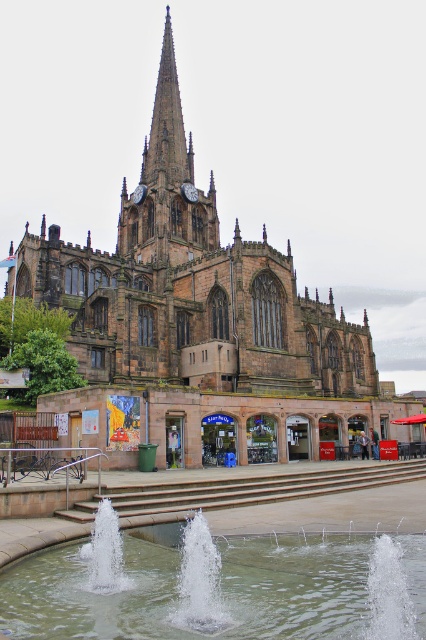
Is point (293, 612) positioned after point (154, 156)?

No, it is in front of (154, 156).

Is clear water fountain at lower center above brown stone spire at upper center?

Actually, clear water fountain at lower center is below brown stone spire at upper center.

Who is more distant from viewer, (229, 584) or (175, 227)?

Point (175, 227)

Find the location of a particular element. This screenshot has height=640, width=426. clear water fountain at lower center is located at coordinates (218, 588).

Is brown stone church at center wider than brown stone spire at upper center?

Yes.

From the picture: Is brown stone church at center to the right of brown stone spire at upper center from the viewer's perspective?

Indeed, brown stone church at center is positioned on the right side of brown stone spire at upper center.

Is point (149, 308) closer to viewer compared to point (203, 234)?

Yes, it is in front of point (203, 234).

In order to click on brown stone church at center in this screenshot , I will do `click(201, 316)`.

Does brown stone church at center lie in front of clear water fountain at lower center?

No, brown stone church at center is further to the viewer.

Does brown stone church at center have a larger size compared to clear water fountain at lower center?

Indeed, brown stone church at center has a larger size compared to clear water fountain at lower center.

Where is `brown stone church at center`? This screenshot has height=640, width=426. brown stone church at center is located at coordinates (201, 316).